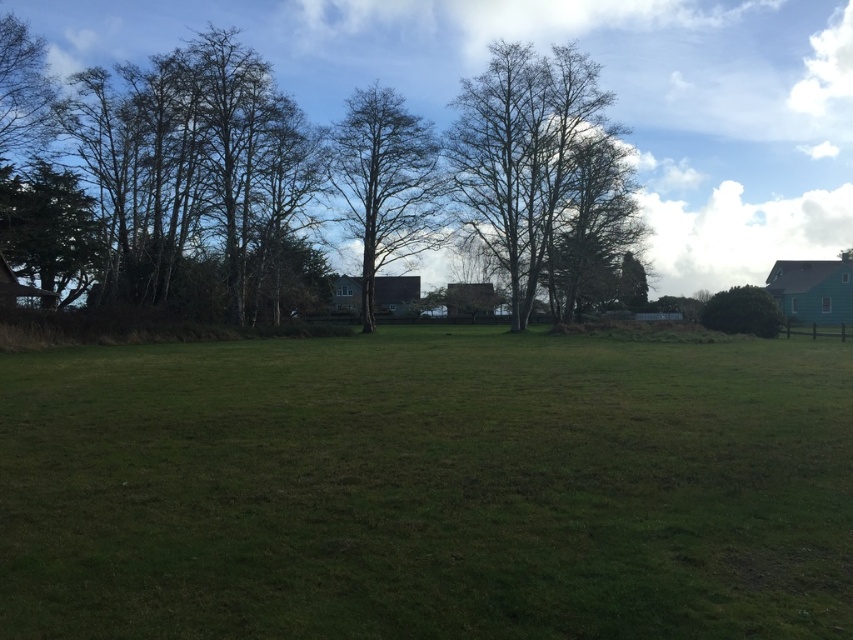
Between green grass at center and bare branches at upper center, which one is positioned lower?

green grass at center

Does point (142, 588) come behind point (129, 292)?

No, it is in front of (129, 292).

Is point (488, 435) positioned before point (531, 122)?

Yes, it is in front of point (531, 122).

Locate an element on the screen. The image size is (853, 640). green grass at center is located at coordinates (427, 488).

Does bare branches at center have a smaller size compared to green leafy bush at right?

Actually, bare branches at center might be larger than green leafy bush at right.

Looking at this image, does bare branches at center have a larger size compared to green leafy bush at right?

Yes, bare branches at center is bigger than green leafy bush at right.

The width and height of the screenshot is (853, 640). What do you see at coordinates (540, 172) in the screenshot?
I see `bare branches at center` at bounding box center [540, 172].

Find the location of `bare branches at center`. bare branches at center is located at coordinates (540, 172).

Is bare branches at center taller than bare wood tree at center?

Yes.

Is bare branches at center below bare wood tree at center?

No, bare branches at center is not below bare wood tree at center.

You are a GUI agent. You are given a task and a screenshot of the screen. Output one action in this format:
    pyautogui.click(x=<x>, y=<y>)
    Task: Click on the bare branches at center
    The height and width of the screenshot is (640, 853).
    Given the screenshot: What is the action you would take?
    pyautogui.click(x=540, y=172)

Identify the location of bare branches at center. (540, 172).